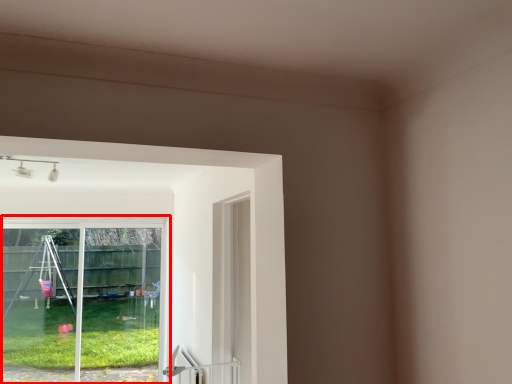
Question: From the image's perspective, what is the correct spatial relationship of window (annotated by the red box) in relation to door handle?

Choices:
 (A) above
 (B) below

Answer: (A)